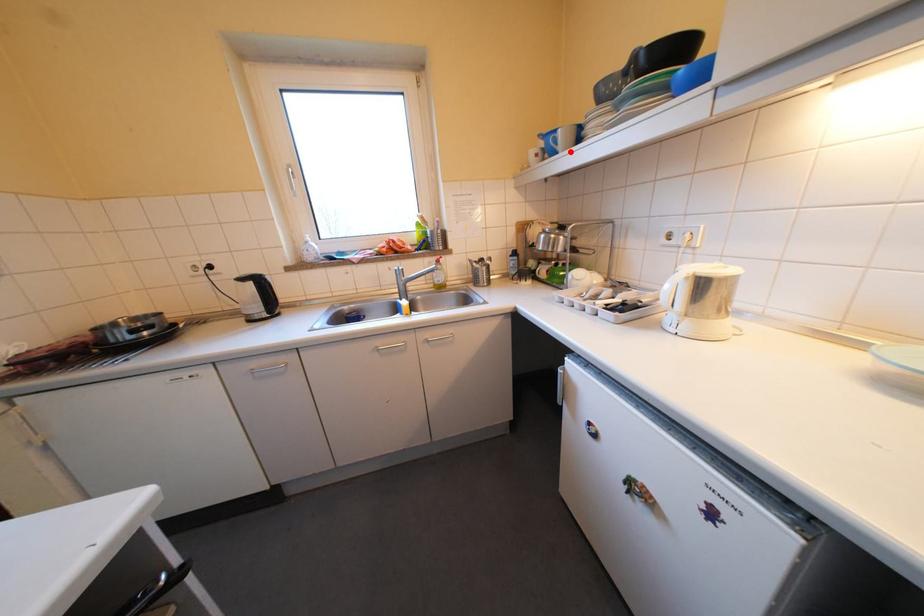
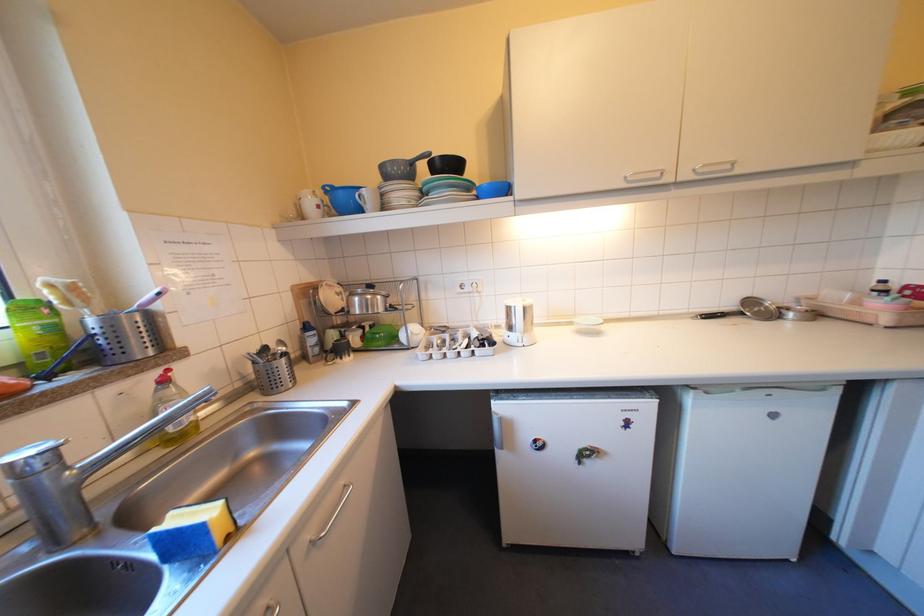
Where in the second image is the point corresponding to the highlighted location from the first image?

(373, 209)